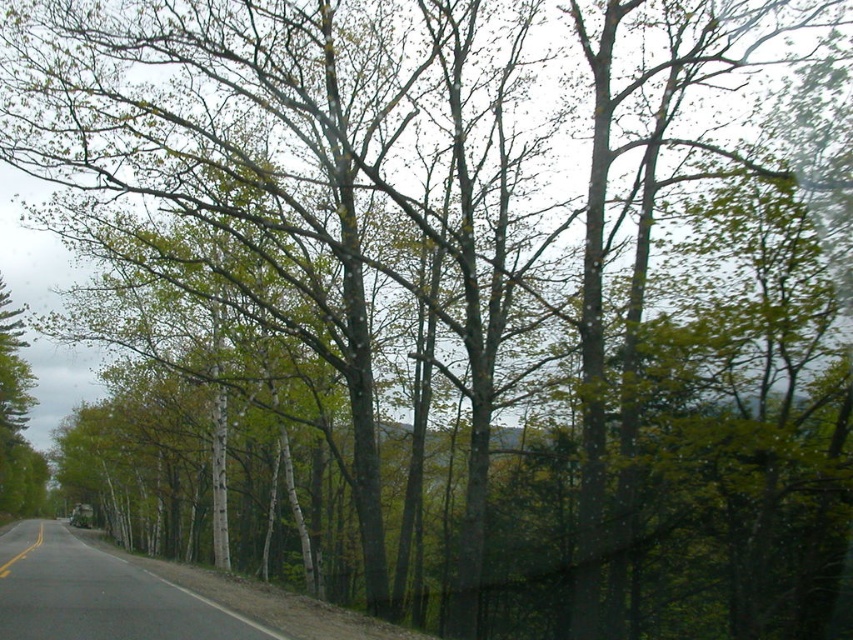
Question: Does green matte tree at left have a greater width compared to yellow painted line at road center?

Choices:
 (A) no
 (B) yes

Answer: (B)

Question: Which point is closer to the camera?

Choices:
 (A) (38, 538)
 (B) (44, 480)

Answer: (A)

Question: Can you confirm if green matte tree at left is positioned to the right of yellow painted line at road center?

Choices:
 (A) no
 (B) yes

Answer: (A)

Question: Which point is farther from the camera taking this photo?

Choices:
 (A) (26, 552)
 (B) (4, 451)

Answer: (B)

Question: Does green matte tree at left come behind yellow painted line at road center?

Choices:
 (A) no
 (B) yes

Answer: (B)